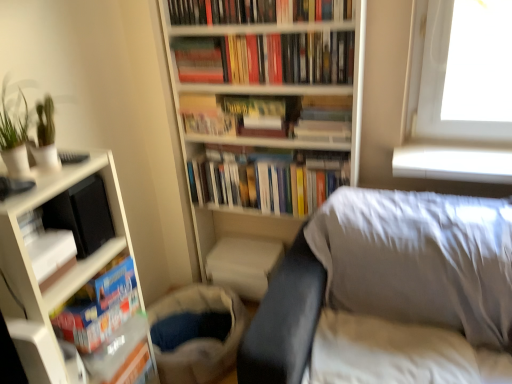
You are a GUI agent. You are given a task and a screenshot of the screen. Output one action in this format:
    pyautogui.click(x=<x>, y=<y>)
    Task: Click on the free point above hardcover book at center, the 1th paperback book viewed from the left (from a real-world perspective)
    This screenshot has height=384, width=512.
    Given the screenshot: What is the action you would take?
    pyautogui.click(x=210, y=113)